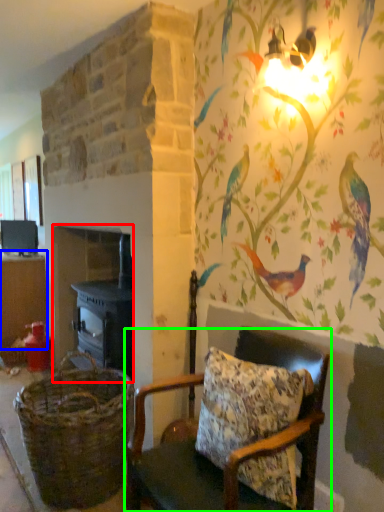
Question: Which object is positioned closest to fireplace (highlighted by a red box)? Select from table (highlighted by a blue box) and chair (highlighted by a green box).

Choices:
 (A) table
 (B) chair

Answer: (A)